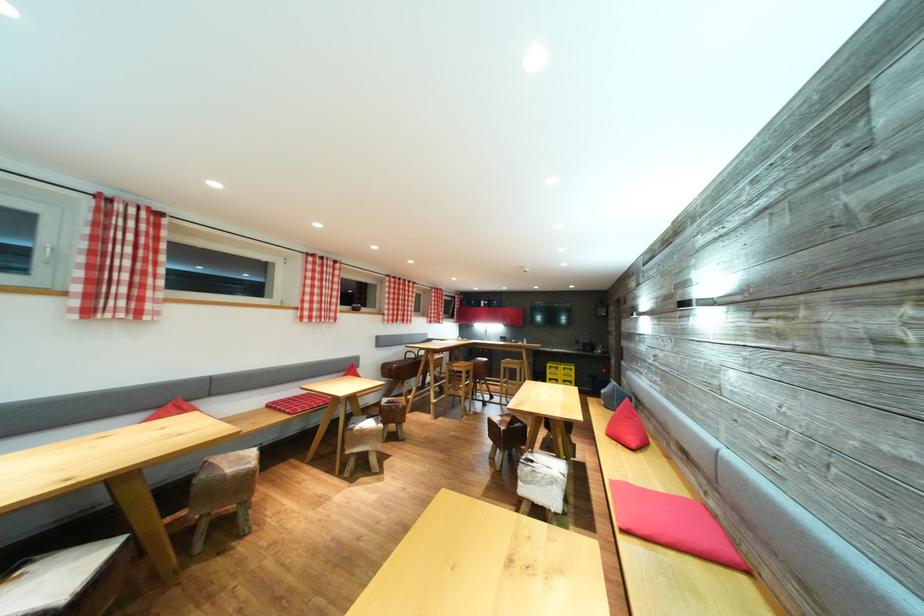
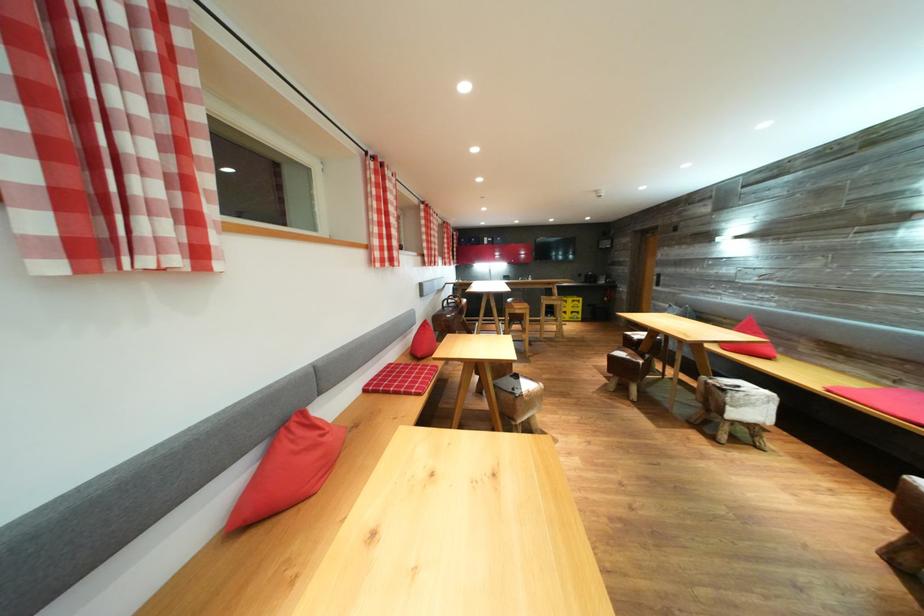
Where in the second image is the point corresponding to (509,434) from the first image?

(648, 367)